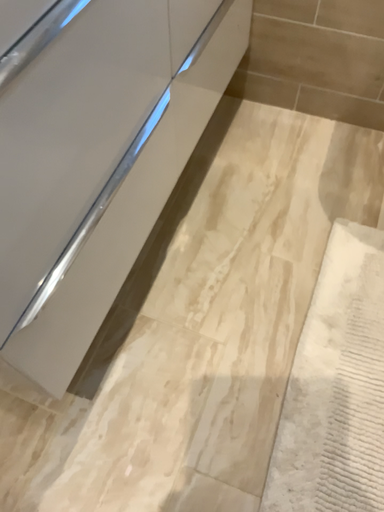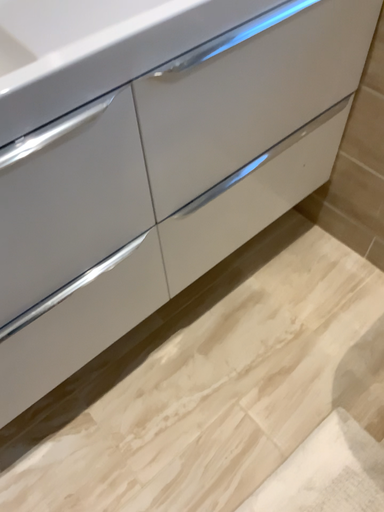
Question: Which way did the camera rotate in the video?

Choices:
 (A) rotated right
 (B) rotated left

Answer: (B)